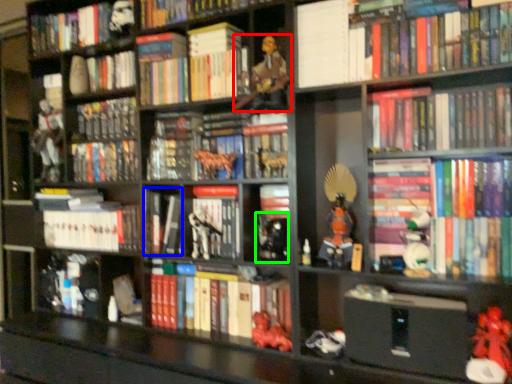
Question: Estimate the real-world distances between objects in this image. Which object is farther from person (highlighted by a red box), book (highlighted by a blue box) or toy (highlighted by a green box)?

Choices:
 (A) book
 (B) toy

Answer: (A)